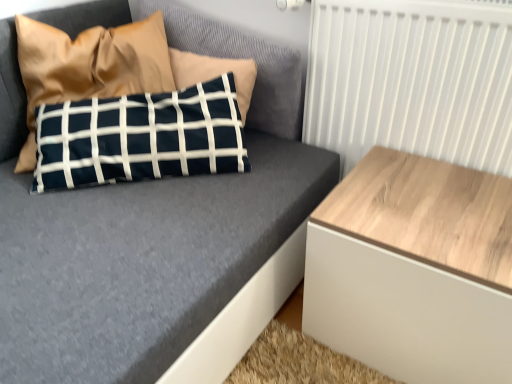
Locate an element on the screen. The width and height of the screenshot is (512, 384). vacant area on top of light wood/texture side table at right (from a real-world perspective) is located at coordinates (433, 202).